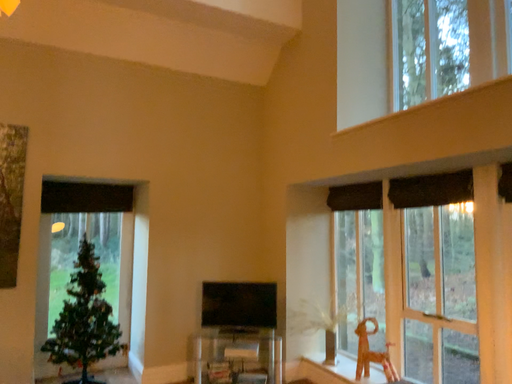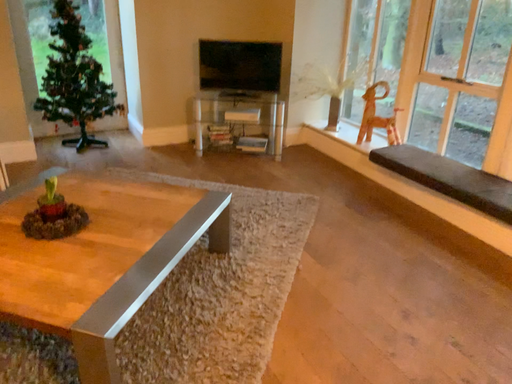
Question: How did the camera likely rotate when shooting the video?

Choices:
 (A) rotated upward
 (B) rotated downward

Answer: (B)